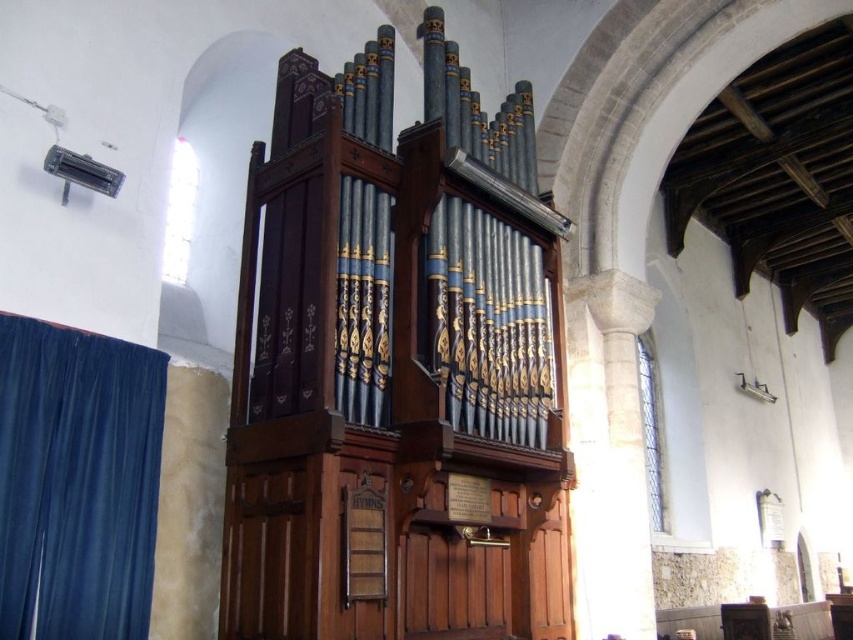
Between wooden pipe organ at center and velvet blue curtain at left, which one is positioned higher?

wooden pipe organ at center is higher up.

Describe the element at coordinates (396, 368) in the screenshot. I see `wooden pipe organ at center` at that location.

The height and width of the screenshot is (640, 853). I want to click on wooden pipe organ at center, so click(396, 368).